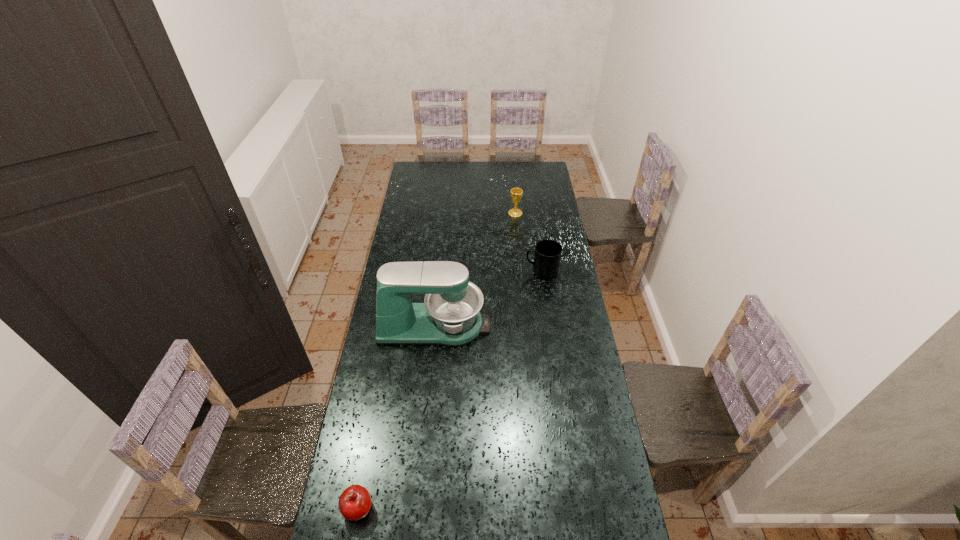
Locate an element on the screen. The width and height of the screenshot is (960, 540). the second nearest object is located at coordinates (449, 316).

This screenshot has height=540, width=960. What are the coordinates of `mixer` in the screenshot? It's located at (449, 316).

You are a GUI agent. You are given a task and a screenshot of the screen. Output one action in this format:
    pyautogui.click(x=<x>, y=<y>)
    Task: Click on the chalice
    Image resolution: width=960 pixels, height=540 pixels.
    Given the screenshot: What is the action you would take?
    pyautogui.click(x=516, y=193)

You are a GUI agent. You are given a task and a screenshot of the screen. Output one action in this format:
    pyautogui.click(x=<x>, y=<y>)
    Task: Click on the mug
    
    Given the screenshot: What is the action you would take?
    pyautogui.click(x=547, y=257)

Identify the location of the nearest object. (354, 503).

Find the location of a particular element. This screenshot has height=540, width=960. the shortest object is located at coordinates (354, 503).

This screenshot has width=960, height=540. I want to click on free location located 0.290m on the front-facing side of the third farthest object, so click(559, 326).

Where is `vacant space situated 0.250m on the front of the chalice`? The height and width of the screenshot is (540, 960). vacant space situated 0.250m on the front of the chalice is located at coordinates point(518,247).

Where is `free space located on the side of the mug with the handle`? free space located on the side of the mug with the handle is located at coordinates (492, 272).

You are a GUI agent. You are given a task and a screenshot of the screen. Output one action in this format:
    pyautogui.click(x=<x>, y=<y>)
    Task: Click on the vacant space located on the side of the mug with the handle
    
    Given the screenshot: What is the action you would take?
    pyautogui.click(x=445, y=272)